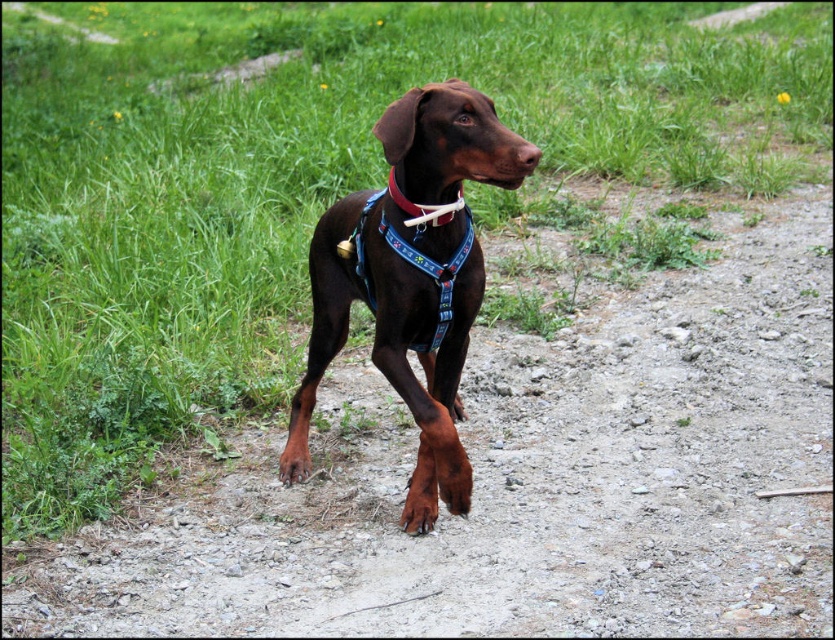
Question: Which point is closer to the camera?

Choices:
 (A) shiny brown dog at center
 (B) dirt track at center

Answer: (A)

Question: Does shiny brown dog at center appear on the left side of smooth red collar at center?

Choices:
 (A) yes
 (B) no

Answer: (B)

Question: Is shiny brown dog at center bigger than smooth red collar at center?

Choices:
 (A) no
 (B) yes

Answer: (B)

Question: Considering the relative positions of dirt track at center and shiny brown dog at center in the image provided, where is dirt track at center located with respect to shiny brown dog at center?

Choices:
 (A) right
 (B) left

Answer: (A)

Question: Among these points, which one is nearest to the camera?

Choices:
 (A) 304,417
 (B) 388,193
 (C) 767,308

Answer: (B)

Question: Based on their relative distances, which object is farther from the dirt track at center?

Choices:
 (A) smooth red collar at center
 (B) shiny brown dog at center

Answer: (A)